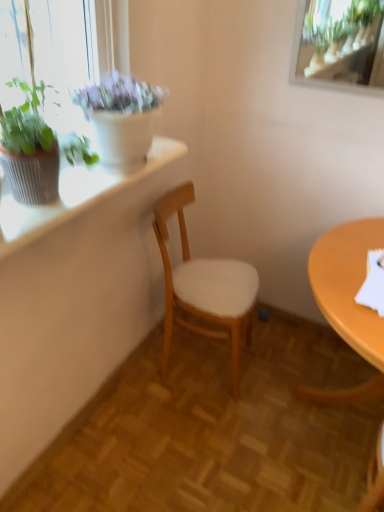
In order to face white woven wood chair at center, should I rotate leftwards or rightwards?

Turn right by 1.984 degrees to look at white woven wood chair at center.

What do you see at coordinates (204, 285) in the screenshot?
I see `white woven wood chair at center` at bounding box center [204, 285].

In order to click on green leafy plant at upper left, which is counted as the 2th houseplant, starting from the back in this screenshot , I will do `click(43, 91)`.

What are the coordinates of `matte white pot at upper left, the 1th houseplant in the back-to-front sequence` in the screenshot? It's located at (121, 116).

Which object is positioned more to the right, matte white pot at upper left, the 2th houseplant in the front-to-back sequence, or textured white window sill at upper left?

matte white pot at upper left, the 2th houseplant in the front-to-back sequence, is more to the right.

Is matte white pot at upper left, the 2th houseplant in the front-to-back sequence, facing away from textured white window sill at upper left?

matte white pot at upper left, the 2th houseplant in the front-to-back sequence, is not turned away from textured white window sill at upper left.

Locate an element on the screen. This screenshot has height=512, width=384. the 1st houseplant positioned above the textured white window sill at upper left (from a real-world perspective) is located at coordinates (121, 116).

Considering the sizes of objects matte white pot at upper left, the 1th houseplant in the back-to-front sequence, and textured white window sill at upper left in the image provided, who is wider, matte white pot at upper left, the 1th houseplant in the back-to-front sequence, or textured white window sill at upper left?

Wider between the two is matte white pot at upper left, the 1th houseplant in the back-to-front sequence.

Measure the distance from textured white window sill at upper left to green leafy plant at upper left, placed as the 1th houseplant when sorted from front to back.

The distance of textured white window sill at upper left from green leafy plant at upper left, placed as the 1th houseplant when sorted from front to back, is 12.89 inches.

Between point (75, 207) and point (23, 57), which one is positioned in front?

The point (75, 207) is more forward.

Does textured white window sill at upper left have a smaller size compared to green leafy plant at upper left, which is counted as the 2th houseplant, starting from the back?

Correct, textured white window sill at upper left occupies less space than green leafy plant at upper left, which is counted as the 2th houseplant, starting from the back.

Is textured white window sill at upper left turned away from green leafy plant at upper left, which is counted as the 2th houseplant, starting from the back?

No.

Is green leafy plant at upper left, placed as the 1th houseplant when sorted from front to back, far away from matte white pot at upper left, the 1th houseplant in the back-to-front sequence?

They are positioned close to each other.

From the picture: From a real-world perspective, is green leafy plant at upper left, which is counted as the 2th houseplant, starting from the back, positioned over matte white pot at upper left, the 2th houseplant in the front-to-back sequence, based on gravity?

Yes.

From the image's perspective, is green leafy plant at upper left, which is counted as the 2th houseplant, starting from the back, under matte white pot at upper left, the 1th houseplant in the back-to-front sequence?

Yes, from the image's perspective, green leafy plant at upper left, which is counted as the 2th houseplant, starting from the back, is below matte white pot at upper left, the 1th houseplant in the back-to-front sequence.

Between point (2, 3) and point (123, 138), which one is positioned in front?

Point (123, 138)

Is white woven wood chair at center closer to the viewer compared to matte white pot at upper left, the 2th houseplant in the front-to-back sequence?

No.

Is white woven wood chair at center not close to matte white pot at upper left, the 1th houseplant in the back-to-front sequence?

That's not correct — white woven wood chair at center is a little close to matte white pot at upper left, the 1th houseplant in the back-to-front sequence.

Does white woven wood chair at center have a greater width compared to matte white pot at upper left, the 2th houseplant in the front-to-back sequence?

Yes, white woven wood chair at center is wider than matte white pot at upper left, the 2th houseplant in the front-to-back sequence.

Looking at this image, from a real-world perspective, is matte white pot at upper left, the 2th houseplant in the front-to-back sequence, above or below green leafy plant at upper left, placed as the 1th houseplant when sorted from front to back?

matte white pot at upper left, the 2th houseplant in the front-to-back sequence, is below green leafy plant at upper left, placed as the 1th houseplant when sorted from front to back.

Is matte white pot at upper left, the 2th houseplant in the front-to-back sequence, oriented towards green leafy plant at upper left, placed as the 1th houseplant when sorted from front to back?

No.

Which of these two, matte white pot at upper left, the 2th houseplant in the front-to-back sequence, or green leafy plant at upper left, which is counted as the 2th houseplant, starting from the back, stands shorter?

matte white pot at upper left, the 2th houseplant in the front-to-back sequence.

From a real-world perspective, is green leafy plant at upper left, which is counted as the 2th houseplant, starting from the back, physically above white woven wood chair at center?

Yes, from a real-world perspective, green leafy plant at upper left, which is counted as the 2th houseplant, starting from the back, is above white woven wood chair at center.

Which of these two, green leafy plant at upper left, which is counted as the 2th houseplant, starting from the back, or white woven wood chair at center, stands taller?

Standing taller between the two is white woven wood chair at center.

Measure the distance between green leafy plant at upper left, placed as the 1th houseplant when sorted from front to back, and white woven wood chair at center.

green leafy plant at upper left, placed as the 1th houseplant when sorted from front to back, and white woven wood chair at center are 30.03 inches apart from each other.

Can you tell me how much green leafy plant at upper left, placed as the 1th houseplant when sorted from front to back, and white woven wood chair at center differ in facing direction?

The facing directions of green leafy plant at upper left, placed as the 1th houseplant when sorted from front to back, and white woven wood chair at center are 7.96 degrees apart.

Considering the sizes of objects white woven wood chair at center and textured white window sill at upper left in the image provided, who is thinner, white woven wood chair at center or textured white window sill at upper left?

textured white window sill at upper left is thinner.

From a real-world perspective, does white woven wood chair at center sit lower than textured white window sill at upper left?

Yes, from a real-world perspective, white woven wood chair at center is under textured white window sill at upper left.

From the picture: Is white woven wood chair at center outside of textured white window sill at upper left?

Indeed, white woven wood chair at center is completely outside textured white window sill at upper left.

Looking at the image, does white woven wood chair at center seem bigger or smaller compared to textured white window sill at upper left?

In the image, white woven wood chair at center appears to be larger than textured white window sill at upper left.

The width and height of the screenshot is (384, 512). I want to click on window sill in front of the matte white pot at upper left, the 2th houseplant in the front-to-back sequence, so click(x=75, y=195).

From the image's perspective, starting from the textured white window sill at upper left, which houseplant is the 1st one above? Please provide its 2D coordinates.

[(43, 91)]

Based on their spatial positions, is textured white window sill at upper left or white woven wood chair at center further from green leafy plant at upper left, which is counted as the 2th houseplant, starting from the back?

Among the two, white woven wood chair at center is located further to green leafy plant at upper left, which is counted as the 2th houseplant, starting from the back.

Looking at the image, which one is located closer to textured white window sill at upper left, green leafy plant at upper left, placed as the 1th houseplant when sorted from front to back, or white woven wood chair at center?

green leafy plant at upper left, placed as the 1th houseplant when sorted from front to back, is closer to textured white window sill at upper left.

Looking at the image, which one is located closer to textured white window sill at upper left, white woven wood chair at center or green leafy plant at upper left, which is counted as the 2th houseplant, starting from the back?

The object closer to textured white window sill at upper left is green leafy plant at upper left, which is counted as the 2th houseplant, starting from the back.

Based on their spatial positions, is green leafy plant at upper left, placed as the 1th houseplant when sorted from front to back, or textured white window sill at upper left closer to white woven wood chair at center?

Based on the image, textured white window sill at upper left appears to be nearer to white woven wood chair at center.

Estimate the real-world distances between objects in this image. Which object is closer to matte white pot at upper left, the 2th houseplant in the front-to-back sequence, white woven wood chair at center or textured white window sill at upper left?

textured white window sill at upper left.

Looking at the image, which one is located closer to white woven wood chair at center, textured white window sill at upper left or matte white pot at upper left, the 2th houseplant in the front-to-back sequence?

Based on the image, textured white window sill at upper left appears to be nearer to white woven wood chair at center.

When comparing their distances from white woven wood chair at center, does green leafy plant at upper left, placed as the 1th houseplant when sorted from front to back, or matte white pot at upper left, the 1th houseplant in the back-to-front sequence, seem closer?

matte white pot at upper left, the 1th houseplant in the back-to-front sequence, lies closer to white woven wood chair at center than the other object.

When comparing their distances from white woven wood chair at center, does textured white window sill at upper left or green leafy plant at upper left, which is counted as the 2th houseplant, starting from the back, seem further?

green leafy plant at upper left, which is counted as the 2th houseplant, starting from the back.

Find the location of `window sill located between green leafy plant at upper left, placed as the 1th houseplant when sorted from front to back, and matte white pot at upper left, the 2th houseplant in the front-to-back sequence, in the depth direction`. window sill located between green leafy plant at upper left, placed as the 1th houseplant when sorted from front to back, and matte white pot at upper left, the 2th houseplant in the front-to-back sequence, in the depth direction is located at coordinates tap(75, 195).

This screenshot has height=512, width=384. I want to click on houseplant positioned between green leafy plant at upper left, which is counted as the 2th houseplant, starting from the back, and white woven wood chair at center from near to far, so tap(121, 116).

In order to click on window sill located between green leafy plant at upper left, placed as the 1th houseplant when sorted from front to back, and white woven wood chair at center in the depth direction in this screenshot , I will do `click(75, 195)`.

You are a GUI agent. You are given a task and a screenshot of the screen. Output one action in this format:
    pyautogui.click(x=<x>, y=<y>)
    Task: Click on the window sill between matte white pot at upper left, the 1th houseplant in the back-to-front sequence, and white woven wood chair at center from top to bottom
    The image size is (384, 512).
    Given the screenshot: What is the action you would take?
    pyautogui.click(x=75, y=195)